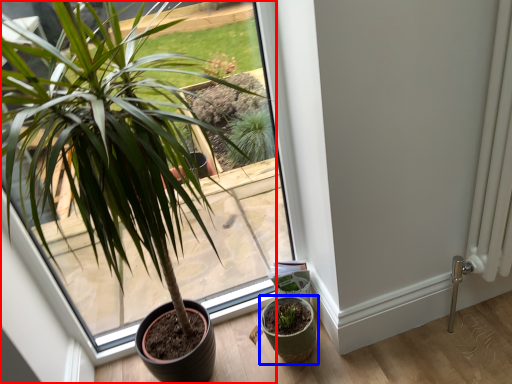
Question: Which object is further to the camera taking this photo, houseplant (highlighted by a red box) or flowerpot (highlighted by a blue box)?

Choices:
 (A) houseplant
 (B) flowerpot

Answer: (B)